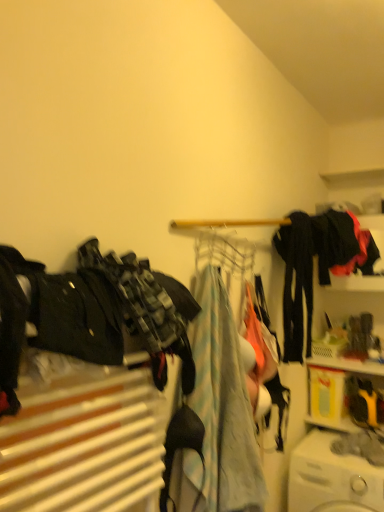
What do you see at coordinates (92, 314) in the screenshot? The image size is (384, 512). I see `camouflage fabric pants at left, which ranks as the fourth clothing in right-to-left order` at bounding box center [92, 314].

The height and width of the screenshot is (512, 384). Identify the location of black matte pants at center right, which is counted as the third clothing, starting from the left. (296, 282).

Which is closer, (241,413) or (217,262)?

Point (241,413)

Is light blue fabric at center, the 3th clothing positioned from the right, facing away from metallic wire clothesline at center?

light blue fabric at center, the 3th clothing positioned from the right, does not have its back to metallic wire clothesline at center.

Is light blue fabric at center, which is the 2th clothing from front to back, to the left of metallic wire clothesline at center from the viewer's perspective?

Correct, you'll find light blue fabric at center, which is the 2th clothing from front to back, to the left of metallic wire clothesline at center.

Is black matte pants at center right, the second clothing when ordered from right to left, facing away from light blue fabric at center, which appears as the 3th clothing when viewed from the back?

black matte pants at center right, the second clothing when ordered from right to left, is not turned away from light blue fabric at center, which appears as the 3th clothing when viewed from the back.

Who is bigger, black matte pants at center right, the 3th clothing in the front-to-back sequence, or light blue fabric at center, placed as the 2th clothing when sorted from left to right?

light blue fabric at center, placed as the 2th clothing when sorted from left to right.

Looking at this image, from a real-world perspective, is black matte pants at center right, the second clothing when ordered from right to left, above or below light blue fabric at center, which is the 2th clothing from front to back?

From a real-world perspective, black matte pants at center right, the second clothing when ordered from right to left, is physically above light blue fabric at center, which is the 2th clothing from front to back.

Considering the relative sizes of black matte pants at center right, the 3th clothing in the front-to-back sequence, and light blue fabric at center, which appears as the 3th clothing when viewed from the back, in the image provided, is black matte pants at center right, the 3th clothing in the front-to-back sequence, taller than light blue fabric at center, which appears as the 3th clothing when viewed from the back,?

In fact, black matte pants at center right, the 3th clothing in the front-to-back sequence, may be shorter than light blue fabric at center, which appears as the 3th clothing when viewed from the back.

Are light blue fabric at center, which appears as the 3th clothing when viewed from the back, and camouflage fabric pants at left, placed as the first clothing when sorted from front to back, making contact?

No, light blue fabric at center, which appears as the 3th clothing when viewed from the back, is not next to camouflage fabric pants at left, placed as the first clothing when sorted from front to back.

Is light blue fabric at center, which appears as the 3th clothing when viewed from the back, taller or shorter than camouflage fabric pants at left, the 1th clothing from the left?

Clearly, light blue fabric at center, which appears as the 3th clothing when viewed from the back, is taller compared to camouflage fabric pants at left, the 1th clothing from the left.

Considering their positions, is light blue fabric at center, which appears as the 3th clothing when viewed from the back, located in front of or behind camouflage fabric pants at left, which is counted as the fourth clothing, starting from the back?

Visually, light blue fabric at center, which appears as the 3th clothing when viewed from the back, is located behind camouflage fabric pants at left, which is counted as the fourth clothing, starting from the back.

Is point (221, 350) in front of point (135, 264)?

No, (221, 350) is further to viewer.

Is point (382, 489) closer to viewer compared to point (239, 431)?

No, (382, 489) is behind (239, 431).

Consider the image. Considering the relative positions of white plastic washing machine at lower right and light blue fabric at center, placed as the 2th clothing when sorted from left to right, in the image provided, is white plastic washing machine at lower right behind light blue fabric at center, placed as the 2th clothing when sorted from left to right,?

Yes, it is.

Does white plastic washing machine at lower right have a greater width compared to light blue fabric at center, placed as the 2th clothing when sorted from left to right?

Indeed, white plastic washing machine at lower right has a greater width compared to light blue fabric at center, placed as the 2th clothing when sorted from left to right.

Who is taller, metallic wire clothesline at center or white plastic washing machine at lower right?

white plastic washing machine at lower right.

Is point (204, 249) closer to viewer compared to point (325, 497)?

That is True.

Are metallic wire clothesline at center and white plastic washing machine at lower right making contact?

No, metallic wire clothesline at center is not next to white plastic washing machine at lower right.

Considering the relative sizes of metallic wire clothesline at center and white plastic washing machine at lower right in the image provided, is metallic wire clothesline at center bigger than white plastic washing machine at lower right?

No, metallic wire clothesline at center is not bigger than white plastic washing machine at lower right.

Which of these two, light blue fabric at center, the 3th clothing positioned from the right, or white plastic washing machine at lower right, is wider?

white plastic washing machine at lower right is wider.

How many degrees apart are the facing directions of light blue fabric at center, the 3th clothing positioned from the right, and white plastic washing machine at lower right?

The facing directions of light blue fabric at center, the 3th clothing positioned from the right, and white plastic washing machine at lower right are 89.2 degrees apart.

From a real-world perspective, is light blue fabric at center, which appears as the 3th clothing when viewed from the back, on white plastic washing machine at lower right?

Indeed, from a real-world perspective, light blue fabric at center, which appears as the 3th clothing when viewed from the back, stands above white plastic washing machine at lower right.

Is light blue fabric at center, which is the 2th clothing from front to back, positioned with its back to white plastic washing machine at lower right?

light blue fabric at center, which is the 2th clothing from front to back, does not have its back to white plastic washing machine at lower right.

Does black matte pants at center right, which is counted as the third clothing, starting from the left, turn towards black matte jacket at upper right, acting as the first clothing starting from the right?

No, black matte pants at center right, which is counted as the third clothing, starting from the left, is not aimed at black matte jacket at upper right, acting as the first clothing starting from the right.

Are black matte pants at center right, which is the 2th clothing in back-to-front order, and black matte jacket at upper right, acting as the first clothing starting from the right, far apart?

No, there isn't a large distance between black matte pants at center right, which is the 2th clothing in back-to-front order, and black matte jacket at upper right, acting as the first clothing starting from the right.

From a real-world perspective, which is physically below, black matte pants at center right, the 3th clothing in the front-to-back sequence, or black matte jacket at upper right, acting as the first clothing starting from the right?

black matte pants at center right, the 3th clothing in the front-to-back sequence, from a real-world perspective.

This screenshot has width=384, height=512. Find the location of `clothesline behind the light blue fabric at center, placed as the 2th clothing when sorted from left to right`. clothesline behind the light blue fabric at center, placed as the 2th clothing when sorted from left to right is located at coordinates (224, 253).

The width and height of the screenshot is (384, 512). I want to click on clothing that is the 1st object located in front of the black matte pants at center right, which is the 2th clothing in back-to-front order, so click(x=220, y=411).

Which object lies further to the anchor point camouflage fabric pants at left, placed as the first clothing when sorted from front to back, black matte pants at center right, the 3th clothing in the front-to-back sequence, or white plastic washing machine at lower right?

The object further to camouflage fabric pants at left, placed as the first clothing when sorted from front to back, is white plastic washing machine at lower right.

Looking at the image, which one is located further to white plastic washing machine at lower right, camouflage fabric pants at left, placed as the first clothing when sorted from front to back, or light blue fabric at center, the 3th clothing positioned from the right?

camouflage fabric pants at left, placed as the first clothing when sorted from front to back.

Based on their spatial positions, is black matte pants at center right, which is the 2th clothing in back-to-front order, or black matte jacket at upper right, acting as the first clothing starting from the right, closer to white plastic washing machine at lower right?

black matte pants at center right, which is the 2th clothing in back-to-front order, is positioned closer to the anchor white plastic washing machine at lower right.

Estimate the real-world distances between objects in this image. Which object is closer to black matte jacket at upper right, which is the 4th clothing from left to right, white plastic washing machine at lower right or light blue fabric at center, placed as the 2th clothing when sorted from left to right?

light blue fabric at center, placed as the 2th clothing when sorted from left to right, lies closer to black matte jacket at upper right, which is the 4th clothing from left to right, than the other object.

Looking at the image, which one is located further to metallic wire clothesline at center, white plastic washing machine at lower right or light blue fabric at center, the 3th clothing positioned from the right?

The object further to metallic wire clothesline at center is white plastic washing machine at lower right.

Which object lies further to the anchor point camouflage fabric pants at left, the 1th clothing from the left, metallic wire clothesline at center or light blue fabric at center, which is the 2th clothing from front to back?

Based on the image, metallic wire clothesline at center appears to be further to camouflage fabric pants at left, the 1th clothing from the left.

Estimate the real-world distances between objects in this image. Which object is closer to metallic wire clothesline at center, black matte jacket at upper right, placed as the 1th clothing when sorted from back to front, or white plastic washing machine at lower right?

Among the two, black matte jacket at upper right, placed as the 1th clothing when sorted from back to front, is located nearer to metallic wire clothesline at center.

Based on their spatial positions, is black matte jacket at upper right, acting as the first clothing starting from the right, or light blue fabric at center, which is the 2th clothing from front to back, further from black matte pants at center right, which is the 2th clothing in back-to-front order?

light blue fabric at center, which is the 2th clothing from front to back, is further to black matte pants at center right, which is the 2th clothing in back-to-front order.

The height and width of the screenshot is (512, 384). Find the location of `clothesline between camouflage fabric pants at left, which is counted as the fourth clothing, starting from the back, and black matte jacket at upper right, acting as the first clothing starting from the right, in the front-back direction`. clothesline between camouflage fabric pants at left, which is counted as the fourth clothing, starting from the back, and black matte jacket at upper right, acting as the first clothing starting from the right, in the front-back direction is located at coordinates (224, 253).

Where is `clothing between camouflage fabric pants at left, which is counted as the fourth clothing, starting from the back, and black matte pants at center right, the 3th clothing in the front-to-back sequence, along the z-axis`? This screenshot has height=512, width=384. clothing between camouflage fabric pants at left, which is counted as the fourth clothing, starting from the back, and black matte pants at center right, the 3th clothing in the front-to-back sequence, along the z-axis is located at coordinates (220, 411).

You are a GUI agent. You are given a task and a screenshot of the screen. Output one action in this format:
    pyautogui.click(x=<x>, y=<y>)
    Task: Click on the clothesline between black matte jacket at upper right, acting as the first clothing starting from the right, and white plastic washing machine at lower right, in the vertical direction
    
    Given the screenshot: What is the action you would take?
    pyautogui.click(x=224, y=253)

Where is `clothesline between camouflage fabric pants at left, which ranks as the fourth clothing in right-to-left order, and black matte pants at center right, which is the 2th clothing in back-to-front order, along the z-axis`? This screenshot has height=512, width=384. clothesline between camouflage fabric pants at left, which ranks as the fourth clothing in right-to-left order, and black matte pants at center right, which is the 2th clothing in back-to-front order, along the z-axis is located at coordinates (224, 253).